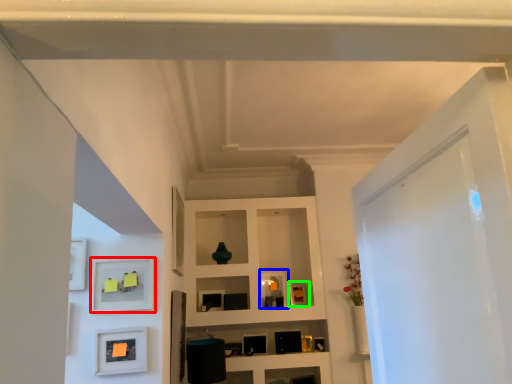
Question: Which object is positioned closest to shelf (highlighted by a red box)? Select from picture frame (highlighted by a blue box) and picture frame (highlighted by a green box).

Choices:
 (A) picture frame
 (B) picture frame

Answer: (A)